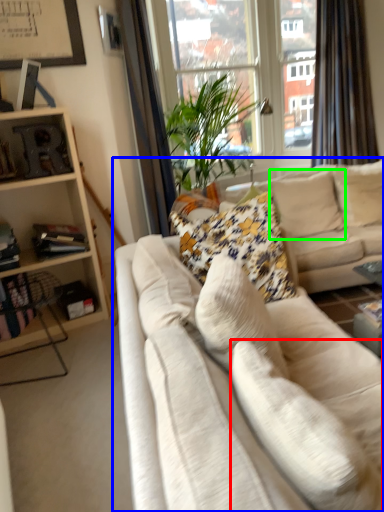
Question: Which object is positioned closest to pillow (highlighted by a red box)? Select from studio couch (highlighted by a blue box) and pillow (highlighted by a green box).

Choices:
 (A) studio couch
 (B) pillow

Answer: (A)